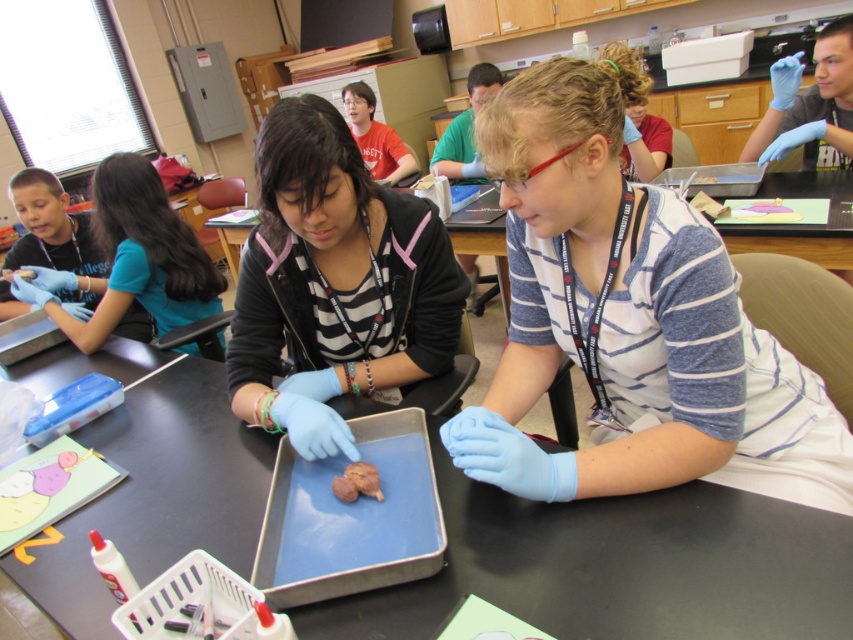
In the classroom scene, you see a blue rubber glove at center and a matte black shirt at center. Which object is positioned to the right side?

The blue rubber glove at center is to the right of the matte black shirt at center.

You are a teacher observing a science experiment in the classroom. You notice two blue rubber gloves on the table. The gloves are labeled as the blue rubber glove at center and the blue rubber glove at left. You need to place a ruler between them to measure the space. Will the ruler, which is 4 feet long, fit perfectly between the two gloves?

The distance between the blue rubber glove at center and the blue rubber glove at left is 4.74 feet. Since the ruler is only 4 feet long, it is shorter than the required distance. Therefore, the ruler will not fit perfectly between the two gloves as it is 0.74 feet too short.

You are a teacher observing the classroom. You notice the matte black shirt at center and the blue rubber glove at left. Which object is wider?

The blue rubber glove at left is wider than the matte black shirt at center.